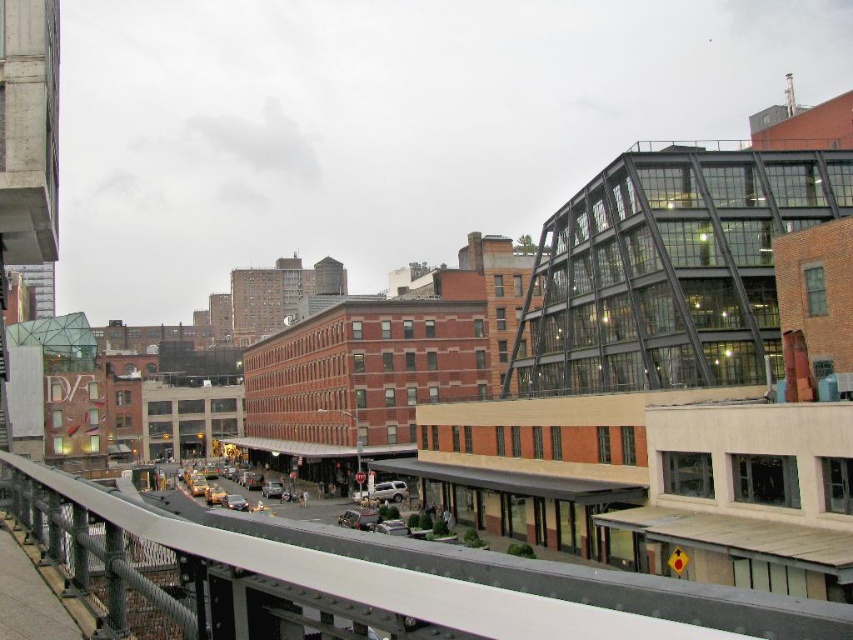
You are standing on a bridge and want to take a photo of the silver metallic car at lower center without including the metallic gray rail at center in the frame. Given their sizes, is it possible to adjust your position to exclude the rail?

The metallic gray rail at center is larger than the silver metallic car at lower center. Since the rail is closer to you, you can move your position slightly to the side or angle your camera to exclude the rail while focusing on the car.

You are standing on a bridge looking down at the street below. You see the metallic gray rail at center and the silver metallic suv at center. Which object is closer to you?

The metallic gray rail at center is closer to you because it is in front of the silver metallic suv at center.